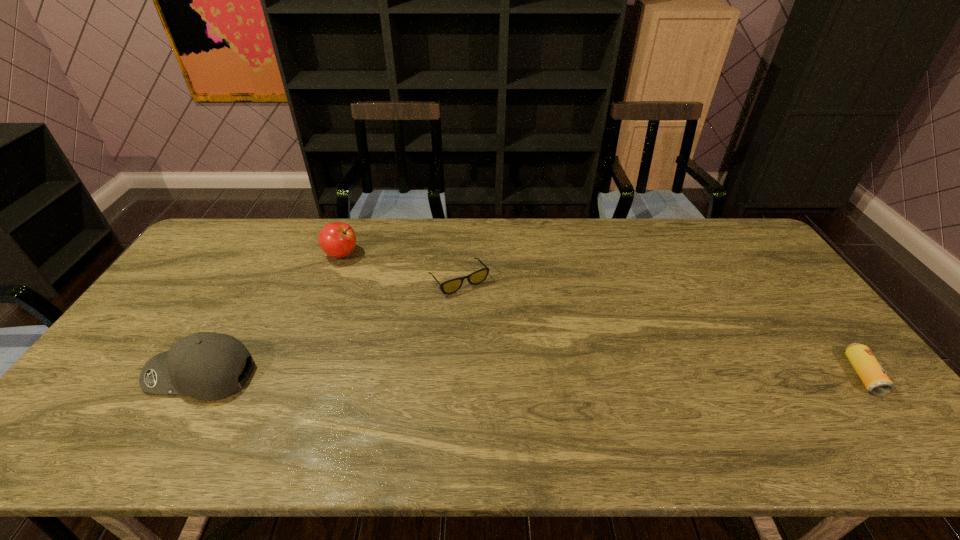
This screenshot has height=540, width=960. I want to click on baseball cap, so click(205, 365).

Find the location of a particular element. This screenshot has height=540, width=960. the rightmost object is located at coordinates (871, 373).

This screenshot has width=960, height=540. What are the coordinates of `the second object from right to left` in the screenshot? It's located at (451, 286).

Where is `apple`? apple is located at coordinates (336, 239).

The width and height of the screenshot is (960, 540). In order to click on vacant area situated on the front brim of the leftmost object in this screenshot , I will do `click(107, 375)`.

The height and width of the screenshot is (540, 960). Find the location of `vacant point located 0.360m on the back of the beer can`. vacant point located 0.360m on the back of the beer can is located at coordinates (778, 268).

This screenshot has width=960, height=540. I want to click on free space located on the front-facing side of the sunglasses, so click(x=535, y=376).

Find the location of a particular element. The height and width of the screenshot is (540, 960). vacant area situated 0.210m on the front-facing side of the sunglasses is located at coordinates (509, 341).

Locate an element on the screen. free space located on the front-facing side of the sunglasses is located at coordinates (531, 370).

At what (x,y) coordinates should I click in order to perform the action: click on vacant space located on the stem of the apple. Please return your answer as a coordinate pair (x, y). The image size is (960, 540). Looking at the image, I should click on (396, 324).